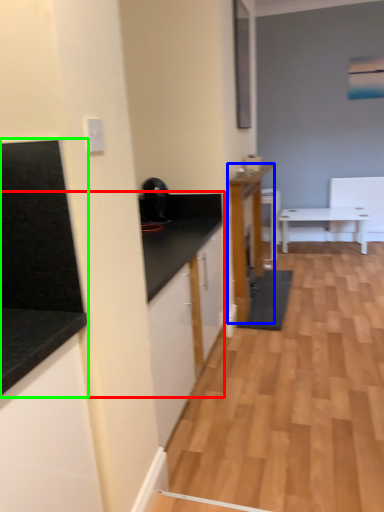
Question: Which object is positioned closest to countertop (highlighted by a red box)? Select from cabinetry (highlighted by a blue box) and countertop (highlighted by a green box).

Choices:
 (A) cabinetry
 (B) countertop

Answer: (B)